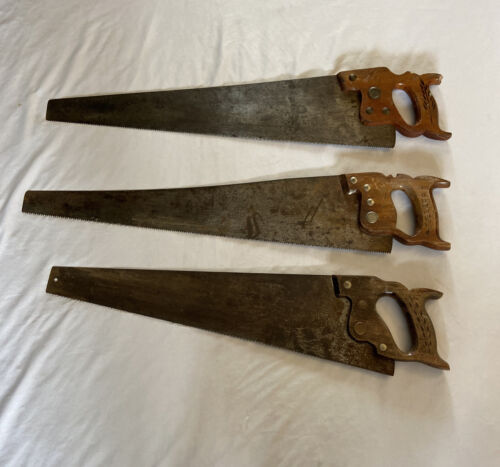
Image resolution: width=500 pixels, height=467 pixels. What are the coordinates of `surface` in the screenshot? It's located at (69, 241).